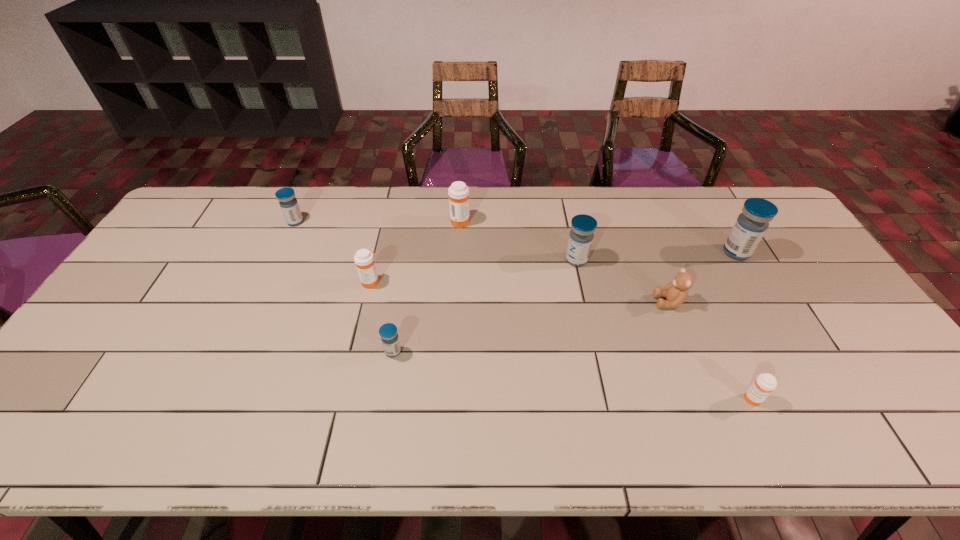
You are a GUI agent. You are given a task and a screenshot of the screen. Output one action in this format:
    pyautogui.click(x=<x>, y=<y>)
    Task: Click on the vacant space at the far left corner
    
    Given the screenshot: What is the action you would take?
    pyautogui.click(x=240, y=199)

This screenshot has height=540, width=960. In the image, there is a desktop. What are the coordinates of `vacant space at the far right corner` in the screenshot? It's located at (726, 191).

Identify the location of free point between the seventh object from right to left and the nearest medicine. (562, 341).

Find the location of a particular element. Image resolution: width=960 pixels, height=540 pixels. free point between the second blue medicine from left to right and the second nearest orange medicine is located at coordinates coord(382,317).

Where is `free space between the fifth object from right to left and the second farthest orange medicine`? The width and height of the screenshot is (960, 540). free space between the fifth object from right to left and the second farthest orange medicine is located at coordinates (416, 252).

The image size is (960, 540). What are the coordinates of `free spot between the fifth object from left to right and the nearest medicine` in the screenshot? It's located at (664, 330).

Where is `blank region between the fifth object from right to left and the leftmost object`? This screenshot has width=960, height=540. blank region between the fifth object from right to left and the leftmost object is located at coordinates (377, 221).

Where is `vacant space that is in between the leftmost object and the third nearest object`? vacant space that is in between the leftmost object and the third nearest object is located at coordinates (482, 262).

Find the location of a particular element. The width and height of the screenshot is (960, 540). vacant area between the third blue medicine from left to right and the rightmost object is located at coordinates (657, 256).

Where is `free space between the fourth medicine from left to right and the second nearest orange medicine`? The image size is (960, 540). free space between the fourth medicine from left to right and the second nearest orange medicine is located at coordinates (416, 252).